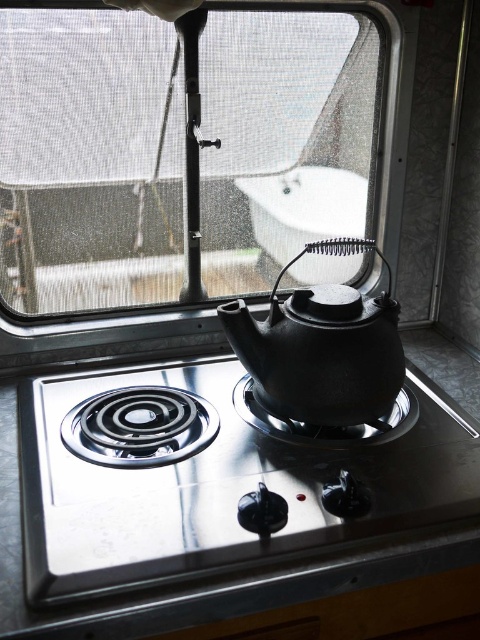
You are a delivery drone that needs to land on the transparent mesh at upper center. The point you must land on is point (88,161). Is this point on the transparent mesh?

Yes, the point (88,161) is on the transparent mesh at upper center, so the drone can land there.

You are preparing to place a new pot on the stove in the kitchen. Given the sizes of the satin silver gas stove at center and the black cast iron teapot at center, which object is bigger?

The satin silver gas stove at center is larger in size than the black cast iron teapot at center, so the stove is bigger.

You are a traveler in a camper van and want to boil water using the black cast iron teapot at center. You notice the transparent mesh at upper center. Is the teapot positioned below the mesh?

Yes, the black cast iron teapot at center is positioned below the transparent mesh at upper center, as the mesh is above it.